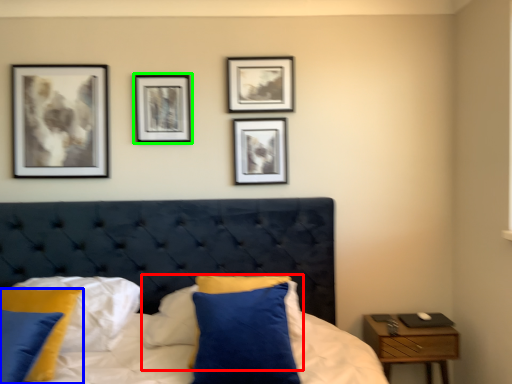
Question: Which is nearer to the pillow (highlighted by a red box)? pillow (highlighted by a blue box) or picture frame (highlighted by a green box).

Choices:
 (A) pillow
 (B) picture frame

Answer: (A)